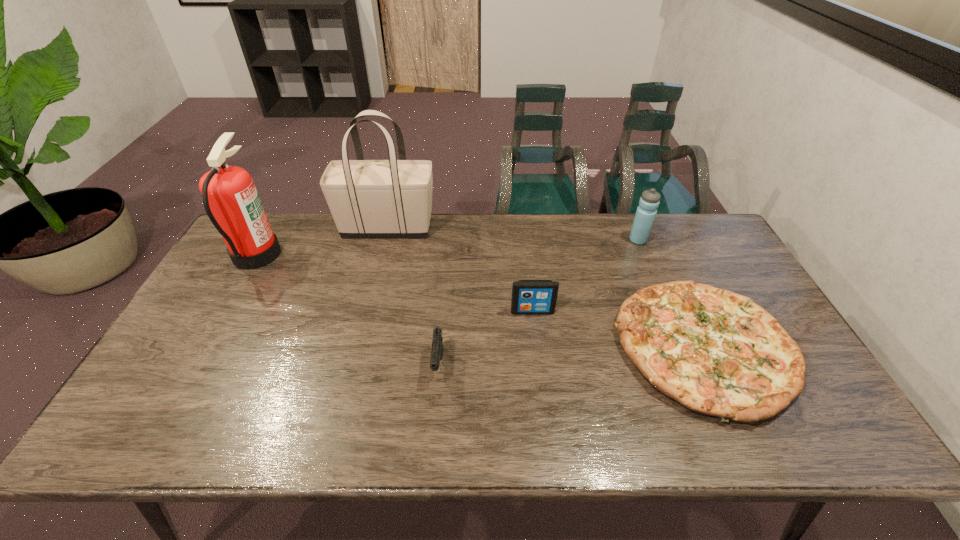
The image size is (960, 540). I want to click on object positioned at the far left corner, so click(x=230, y=198).

Where is `object that is at the near right corner`? The width and height of the screenshot is (960, 540). object that is at the near right corner is located at coordinates (716, 352).

This screenshot has width=960, height=540. I want to click on blank space at the far edge of the desktop, so click(x=450, y=227).

In the image, there is a desktop. Identify the location of vacant space at the near edge. (478, 446).

Where is `vacant space at the left edge`? vacant space at the left edge is located at coordinates (252, 273).

The image size is (960, 540). I want to click on free space at the near left corner of the desktop, so click(138, 446).

Locate an element on the screen. This screenshot has height=540, width=960. vacant space at the far right corner of the desktop is located at coordinates (698, 230).

Where is `free spot between the leftmost object and the third tallest object`? The height and width of the screenshot is (540, 960). free spot between the leftmost object and the third tallest object is located at coordinates (447, 247).

I want to click on free point between the iPod and the shopping bag, so click(460, 269).

I want to click on vacant space that's between the water bottle and the fire extinguisher, so click(x=447, y=247).